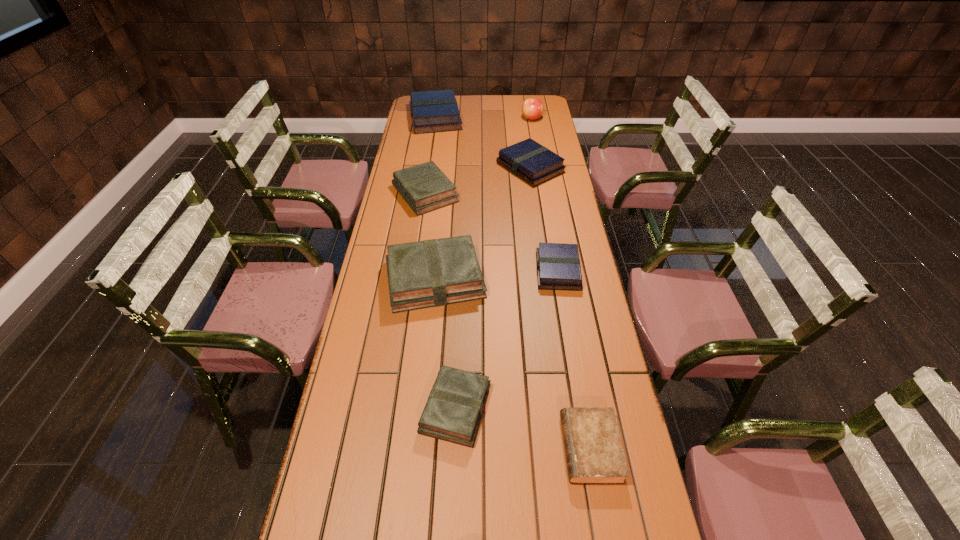
Identify which blue book is the second nearest to the second biggest blue book. Please provide its 2D coordinates. Your answer should be formatted as a tuple, i.e. [(x, y)], where the tuple contains the x and y coordinates of a point satisfying the conditions above.

[(558, 267)]

You are a GUI agent. You are given a task and a screenshot of the screen. Output one action in this format:
    pyautogui.click(x=<x>, y=<y>)
    Task: Click on the closest blue book to the biggest blue book
    This screenshot has width=960, height=540.
    Given the screenshot: What is the action you would take?
    pyautogui.click(x=535, y=164)

Identify which greenish book is located as the third nearest to the nearest blue book. Please provide its 2D coordinates. Your answer should be formatted as a tuple, i.e. [(x, y)], where the tuple contains the x and y coordinates of a point satisfying the conditions above.

[(455, 405)]

You are a GUI agent. You are given a task and a screenshot of the screen. Output one action in this format:
    pyautogui.click(x=<x>, y=<y>)
    Task: Click on the greenish book identified as the closest to the second farthest blue book
    This screenshot has height=540, width=960.
    Given the screenshot: What is the action you would take?
    pyautogui.click(x=424, y=187)

At what (x,y) coordinates should I click in order to perform the action: click on free region that satisfies the following two spatial constraints: 1. on the back side of the second smallest greenish book; 2. on the right side of the second smallest blue book. Please return your answer as a coordinate pair (x, y). Looking at the image, I should click on (429, 168).